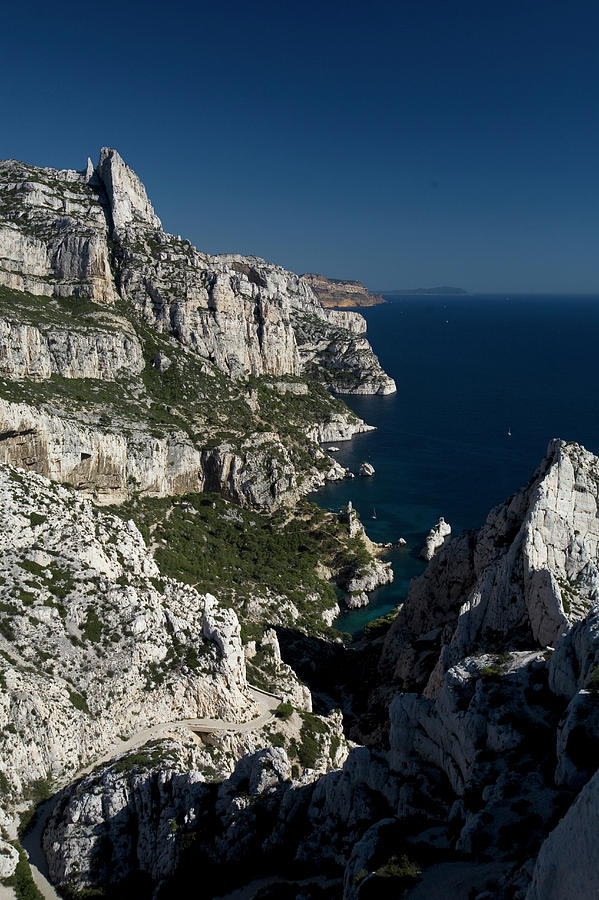
This screenshot has width=599, height=900. Find the location of `picture`. picture is located at coordinates (282, 536).